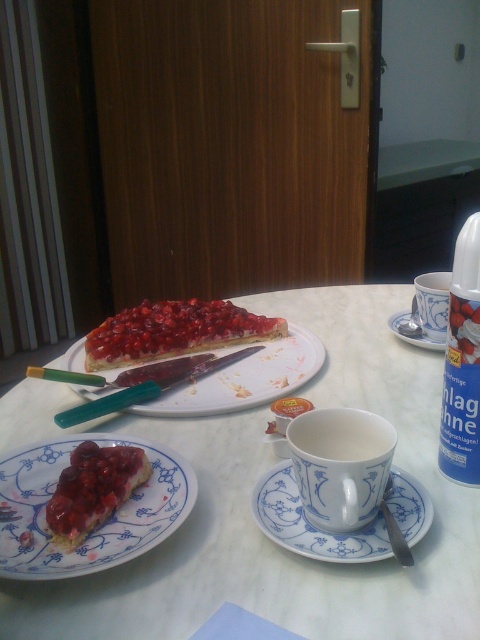
You are a diner sitting at the white glossy table at center. You want to reach the white ceramic plate at center to take a piece of pie. Is the plate within your immediate reach without moving your chair?

The white glossy table at center is below the white ceramic plate at center, meaning the plate is placed on the table. Since the plate is on the table, it should be within your immediate reach without needing to move your chair.